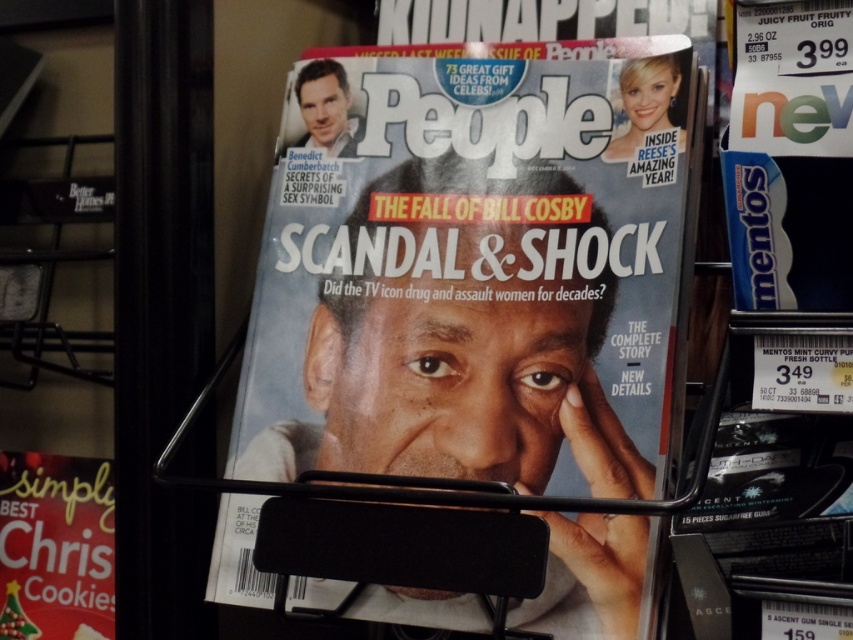
What is the spatial relationship between the blue glossy mentos at right and the matte red christmas cookies at lower left in the magazine rack?

The blue glossy mentos at right is positioned to the right of the matte red christmas cookies at lower left.

You are a customer in a store and want to grab both the matte paper magazine at center and the matte red christmas cookies at lower left. Which item should you reach for first to get the one closer to you?

The matte paper magazine at center is closer to the viewer than the matte red christmas cookies at lower left, so you should reach for the matte paper magazine at center first.